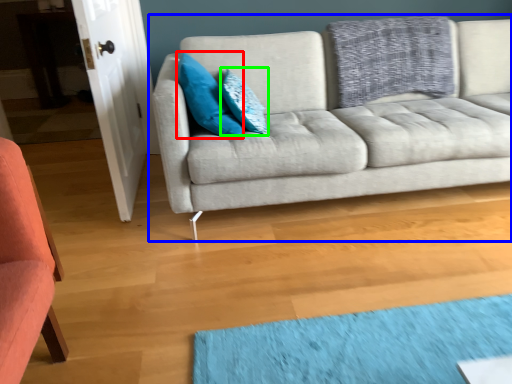
Question: Estimate the real-world distances between objects in this image. Which object is farther from pillow (highlighted by a red box), studio couch (highlighted by a blue box) or pillow (highlighted by a green box)?

Choices:
 (A) studio couch
 (B) pillow

Answer: (A)